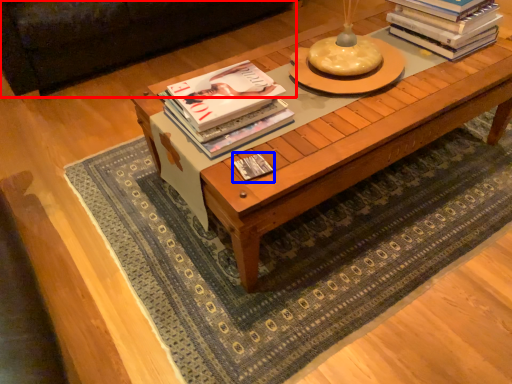
Question: Which object is closer to the camera taking this photo, couch (highlighted by a red box) or book (highlighted by a blue box)?

Choices:
 (A) couch
 (B) book

Answer: (B)